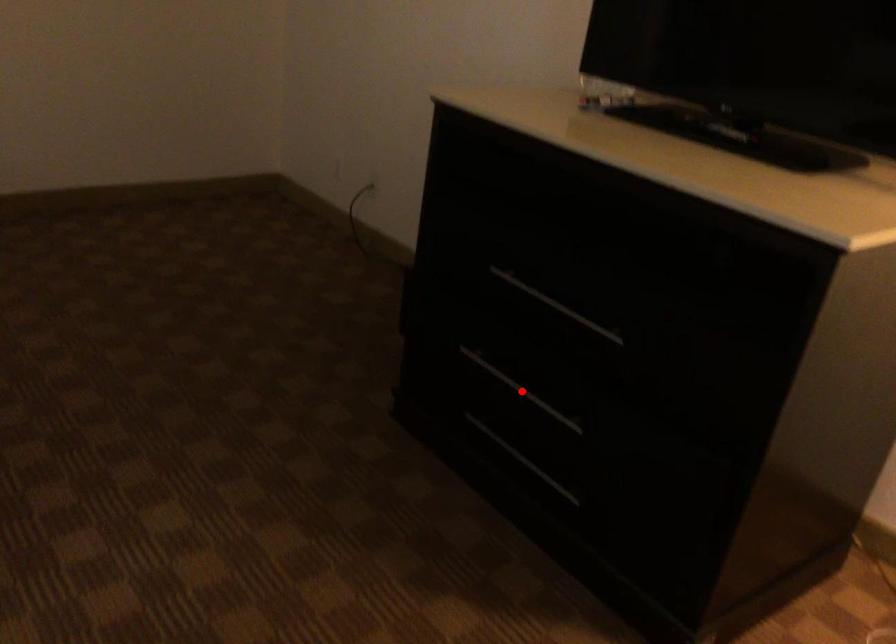
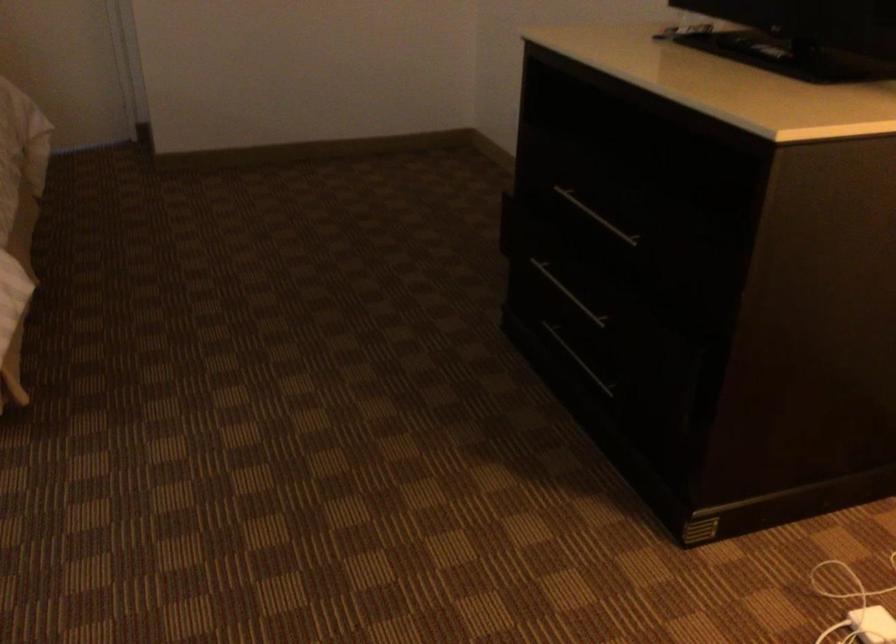
Question: A red point is marked in image1. In image2, is the corresponding 3D point closer to the camera or farther? Reply with the corresponding letter.

Choices:
 (A) The corresponding 3D point is closer.
 (B) The corresponding 3D point is farther.

Answer: (B)